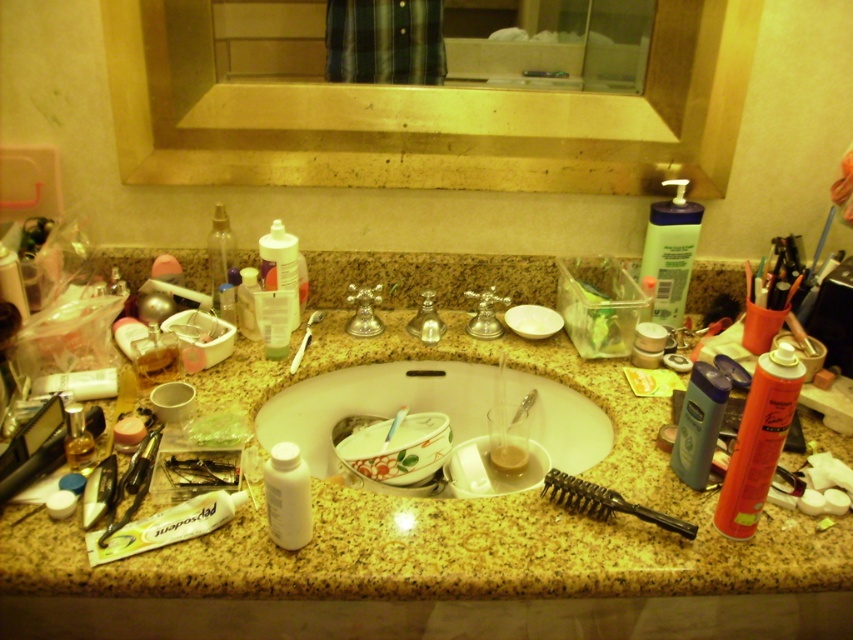
Question: Can you confirm if granite countertop at center is bigger than white plastic pump bottle at right?

Choices:
 (A) yes
 (B) no

Answer: (A)

Question: Which point is closer to the camera taking this photo?

Choices:
 (A) (498, 324)
 (B) (347, 390)
 (C) (688, 481)
 (D) (776, 385)

Answer: (D)

Question: Which point is closer to the camera taking this photo?

Choices:
 (A) tap(781, 353)
 (B) tap(645, 572)
 (C) tap(486, 292)

Answer: (A)

Question: Which of the following is the farthest from the observer?

Choices:
 (A) white plastic bottle at center
 (B) silver metallic faucet at center
 (C) transparent plastic spray bottle at center

Answer: (B)

Question: From the image, what is the correct spatial relationship of granite countertop at center in relation to translucent plastic bottle at left?

Choices:
 (A) left
 (B) right

Answer: (B)

Question: Does granite countertop at center appear on the left side of transparent plastic spray bottle at center?

Choices:
 (A) yes
 (B) no

Answer: (B)